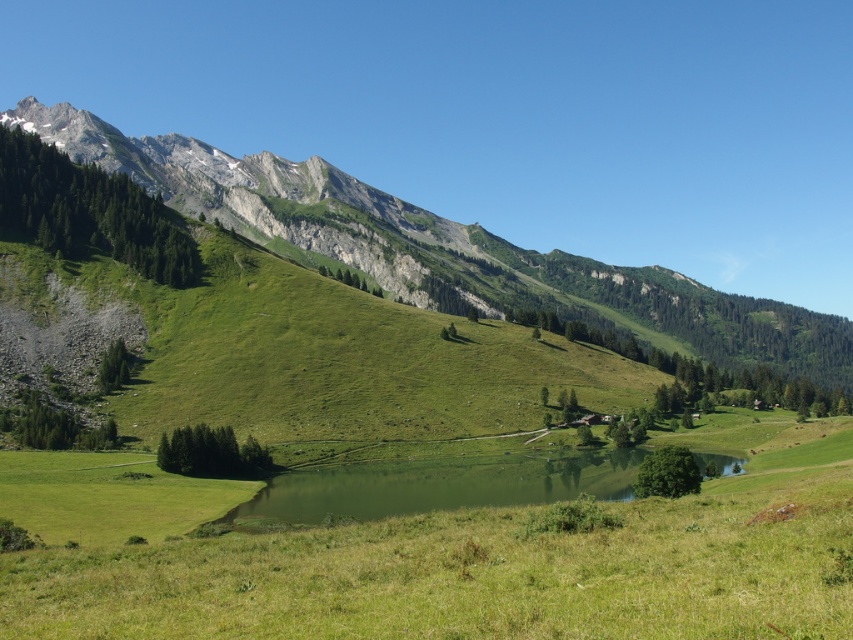
You are standing at the base of the green grassy hillside at upper left and want to walk to the green grassy lake at center. Which direction should you head to reach the lake?

The green grassy hillside at upper left is positioned over the green grassy lake at center, so you should head downward to reach the lake.

You are planning to set up a picnic area in this mountain landscape. The picnic area requires a large, flat space. Based on the image, which location between the green grassy hillside at upper left and the green grassy lake at center would be more suitable for the picnic area?

The green grassy hillside at upper left has a larger size compared to the green grassy lake at center, making it more suitable for setting up a picnic area that requires a large, flat space.

You are standing in the mountain landscape and want to reach the two points marked in the image. Which point, point (373, 216) or point (619, 492), is closer to you?

Point (373, 216) is closer to you because it is further to the viewer than point (619, 492).